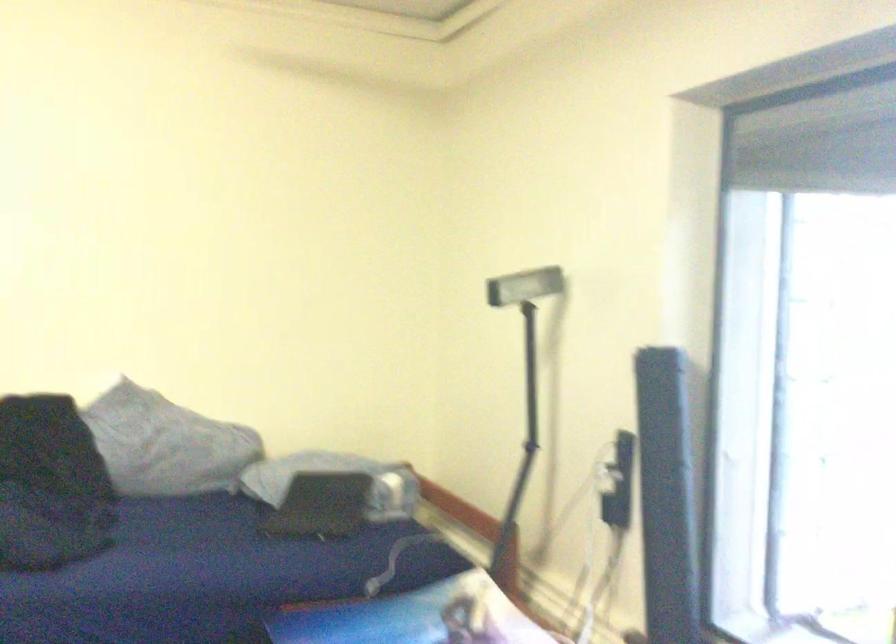
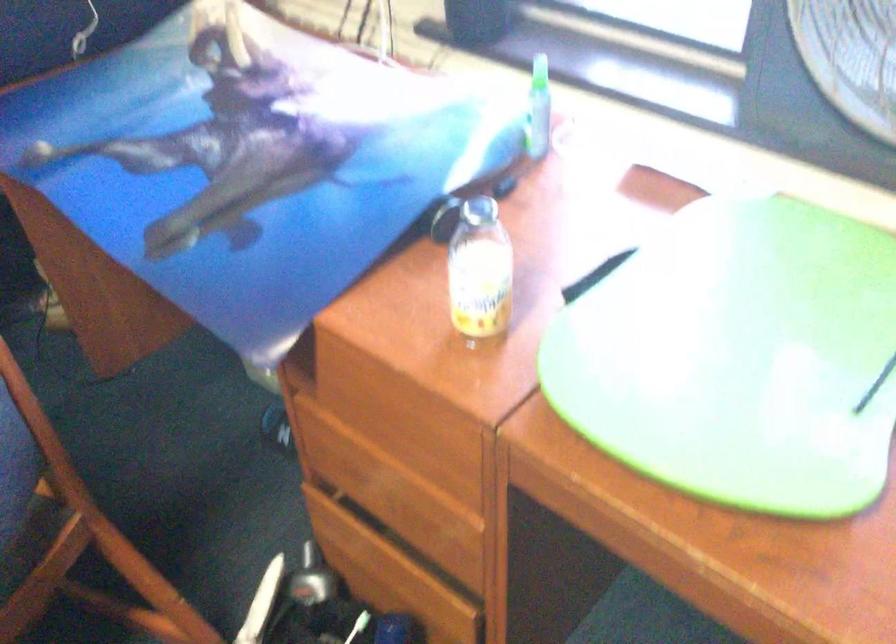
First-person continuous shooting, in which direction is the camera rotating?

The rotation direction of the camera is right-down.